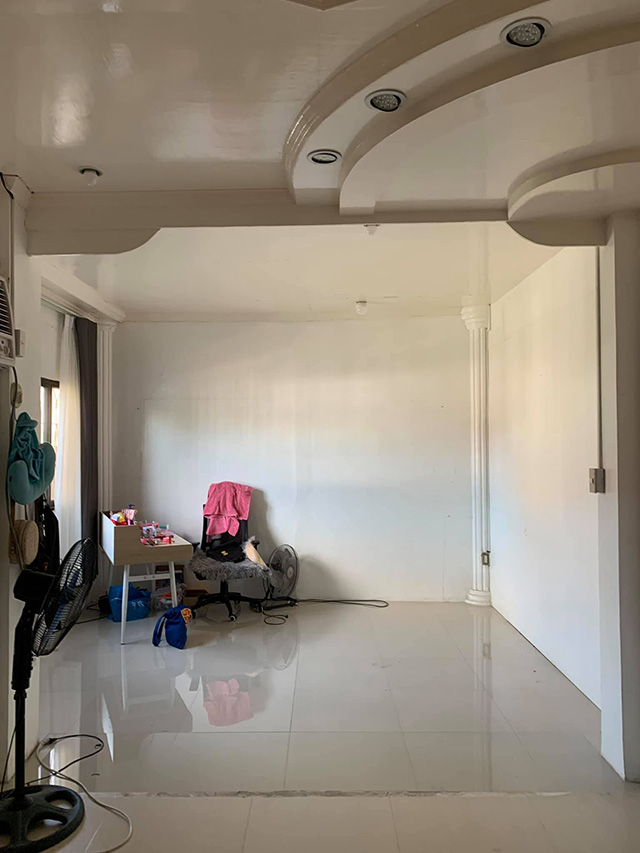
The height and width of the screenshot is (853, 640). I want to click on wall between pillars, so click(304, 437).